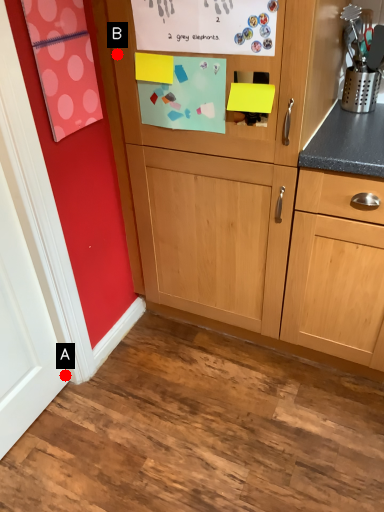
Question: Two points are circled on the image, labeled by A and B beside each circle. Which point is closer to the camera?

Choices:
 (A) A is closer
 (B) B is closer

Answer: (B)